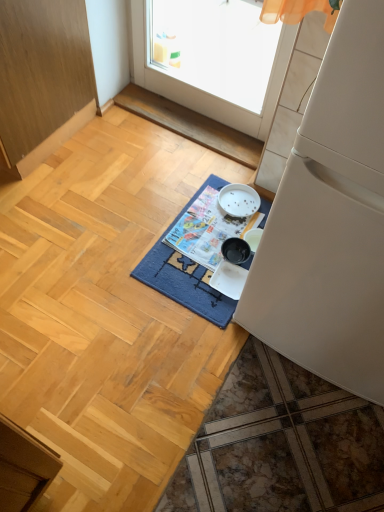
At what (x,y) coordinates should I click in order to perform the action: click on vacant space in front of blue woven mat at center. Please return your answer as a coordinate pair (x, y). Looking at the image, I should click on 192,374.